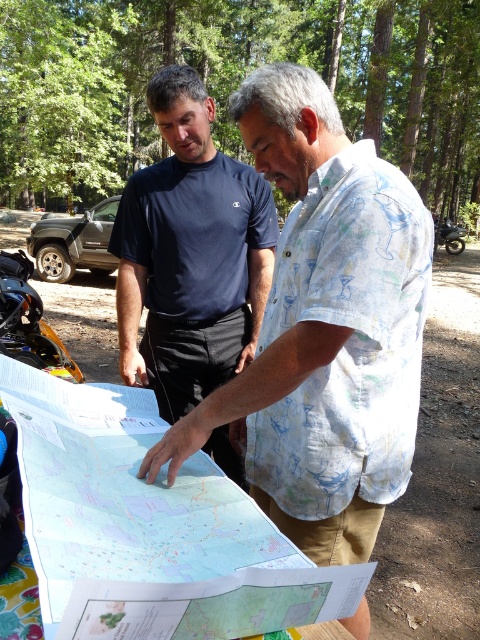
You are standing in the forest and see two points marked on the map. The first point is at coordinates point (x=59, y=513) and the second is at point (x=457, y=234). Which point is closer to you?

Point (x=59, y=513) is closer to the viewer than point (x=457, y=234).

You are a hiker trying to decide where to place your backpack. You see the white printed shirt at center and the brushed metal motorcycle at center right. Which object should you place your backpack next to if you want it closer to the ground?

The white printed shirt at center is located below the brushed metal motorcycle at center right, so placing the backpack next to the white printed shirt at center would be closer to the ground.

You are a hiker who wants to ensure your backpack won t block your view of the map. Your backpack is 18 inches wide. Based on the scene, can you determine if the light blue paper map at center is far enough away from you to avoid obstruction?

The light blue paper map at center is 21.44 inches away from the camera, which is farther than the backpack width of 18 inches. Therefore, the backpack won t block the view of the map.